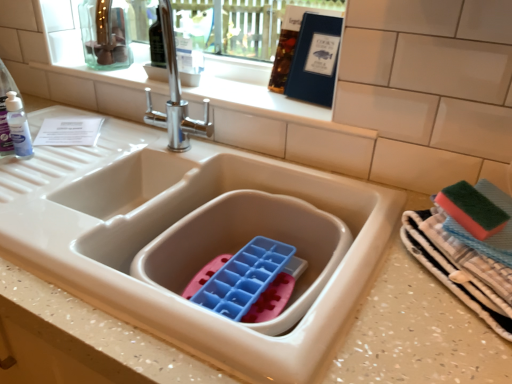
This screenshot has height=384, width=512. Describe the element at coordinates (468, 248) in the screenshot. I see `textured cotton towels at right` at that location.

Find the location of `textured cotton towels at right`. textured cotton towels at right is located at coordinates (468, 248).

Locate an element on the screen. satin nickel faucet at upper center is located at coordinates (175, 95).

This screenshot has height=384, width=512. Describe the element at coordinates (175, 95) in the screenshot. I see `satin nickel faucet at upper center` at that location.

I want to click on textured cotton towels at right, so 468,248.

Considering the positions of objects textured cotton towels at right and satin nickel faucet at upper center in the image provided, who is more to the left, textured cotton towels at right or satin nickel faucet at upper center?

satin nickel faucet at upper center is more to the left.

Which object is closer to the camera taking this photo, textured cotton towels at right or satin nickel faucet at upper center?

textured cotton towels at right is in front.

Which is nearer, [439,231] or [187,110]?

Point [439,231]

Looking at this image, from the image's perspective, is textured cotton towels at right positioned above or below satin nickel faucet at upper center?

From the image's perspective, textured cotton towels at right appears below satin nickel faucet at upper center.

From a real-world perspective, between textured cotton towels at right and satin nickel faucet at upper center, who is vertically lower?

textured cotton towels at right, from a real-world perspective.

Which object is wider, textured cotton towels at right or satin nickel faucet at upper center?

With larger width is textured cotton towels at right.

Between textured cotton towels at right and satin nickel faucet at upper center, which one has more height?

Standing taller between the two is satin nickel faucet at upper center.

Between textured cotton towels at right and satin nickel faucet at upper center, which one has larger size?

Bigger between the two is textured cotton towels at right.

Would you say satin nickel faucet at upper center is part of textured cotton towels at right's contents?

Definitely not — satin nickel faucet at upper center is not inside textured cotton towels at right.

Can you see textured cotton towels at right touching satin nickel faucet at upper center?

No, textured cotton towels at right is not in contact with satin nickel faucet at upper center.

Is textured cotton towels at right aimed at satin nickel faucet at upper center?

No, textured cotton towels at right is not aimed at satin nickel faucet at upper center.

How many degrees apart are the facing directions of textured cotton towels at right and satin nickel faucet at upper center?

They differ by 2.24 degrees in their facing directions.

In order to click on laundry beneath the satin nickel faucet at upper center (from a real-world perspective) in this screenshot , I will do `click(468, 248)`.

Considering the positions of objects satin nickel faucet at upper center and textured cotton towels at right in the image provided, who is more to the right, satin nickel faucet at upper center or textured cotton towels at right?

Positioned to the right is textured cotton towels at right.

Which object is closer to the camera taking this photo, satin nickel faucet at upper center or textured cotton towels at right?

textured cotton towels at right.

Which is in front, point (170, 21) or point (445, 204)?

The point (445, 204) is in front.

From the image's perspective, between satin nickel faucet at upper center and textured cotton towels at right, which one is located above?

satin nickel faucet at upper center appears higher in the image.

Based on the photo, from a real-world perspective, who is located lower, satin nickel faucet at upper center or textured cotton towels at right?

textured cotton towels at right.

Is satin nickel faucet at upper center wider or thinner than textured cotton towels at right?

satin nickel faucet at upper center is thinner than textured cotton towels at right.

Can you confirm if satin nickel faucet at upper center is taller than textured cotton towels at right?

Indeed, satin nickel faucet at upper center has a greater height compared to textured cotton towels at right.

Looking at the image, does satin nickel faucet at upper center seem bigger or smaller compared to textured cotton towels at right?

Clearly, satin nickel faucet at upper center is smaller in size than textured cotton towels at right.

Is textured cotton towels at right surrounded by satin nickel faucet at upper center?

No.

Are satin nickel faucet at upper center and textured cotton towels at right located far from each other?

No, satin nickel faucet at upper center is not far away from textured cotton towels at right.

Could you tell me if satin nickel faucet at upper center is facing textured cotton towels at right?

No, satin nickel faucet at upper center is not oriented towards textured cotton towels at right.

Can you tell me how much satin nickel faucet at upper center and textured cotton towels at right differ in facing direction?

The angular difference between satin nickel faucet at upper center and textured cotton towels at right is 2.24 degrees.

Image resolution: width=512 pixels, height=384 pixels. What are the coordinates of `laundry that appears below the satin nickel faucet at upper center (from a real-world perspective)` in the screenshot? It's located at click(468, 248).

This screenshot has width=512, height=384. What are the coordinates of `tap on the left of textured cotton towels at right` in the screenshot? It's located at (175, 95).

Where is `tap behind the textured cotton towels at right`? This screenshot has width=512, height=384. tap behind the textured cotton towels at right is located at coordinates (175, 95).